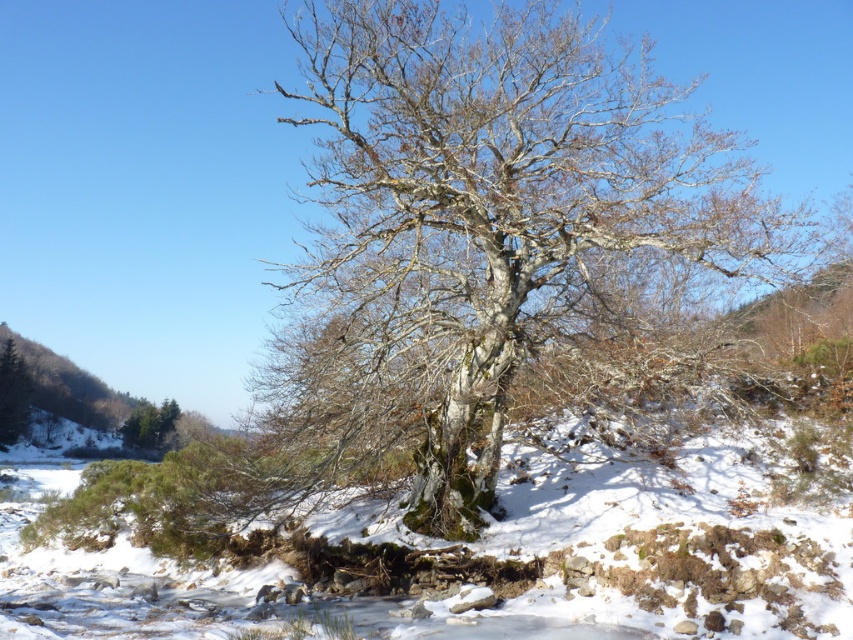
Is green mossy tree at left positioned in front of green matte tree at lower left?

No, it is behind green matte tree at lower left.

Is point (15, 362) positioned before point (138, 424)?

No, (15, 362) is behind (138, 424).

Does point (6, 348) come closer to viewer compared to point (146, 412)?

No.

Locate an element on the screen. green mossy tree at left is located at coordinates (12, 394).

Does gray bark tree at center appear on the right side of green mossy tree at left?

Correct, you'll find gray bark tree at center to the right of green mossy tree at left.

Who is more distant from viewer, (421, 484) or (22, 413)?

Positioned behind is point (22, 413).

Find the location of `gray bark tree at center`. gray bark tree at center is located at coordinates (474, 228).

Which is above, gray bark tree at center or green matte tree at lower left?

gray bark tree at center is higher up.

The width and height of the screenshot is (853, 640). In order to click on gray bark tree at center in this screenshot , I will do `click(474, 228)`.